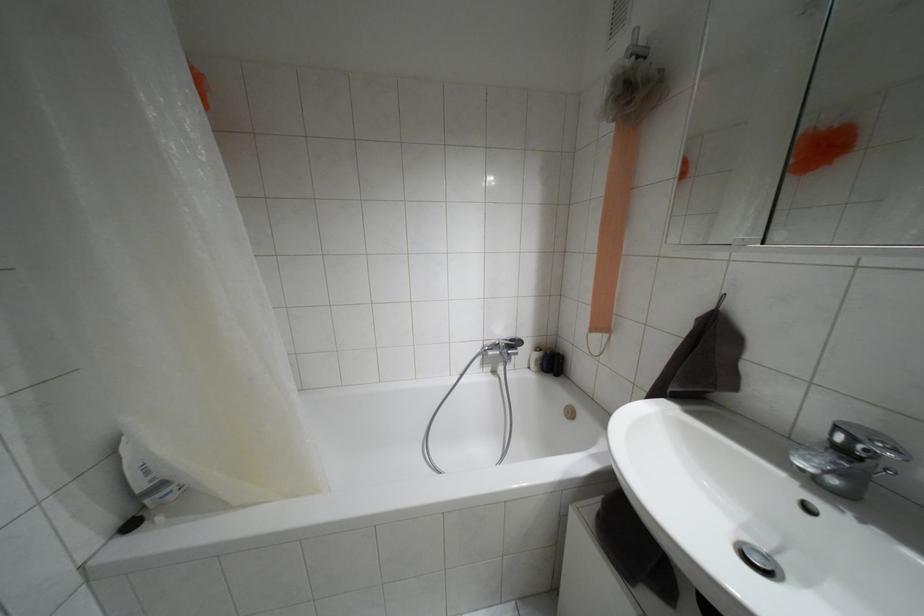
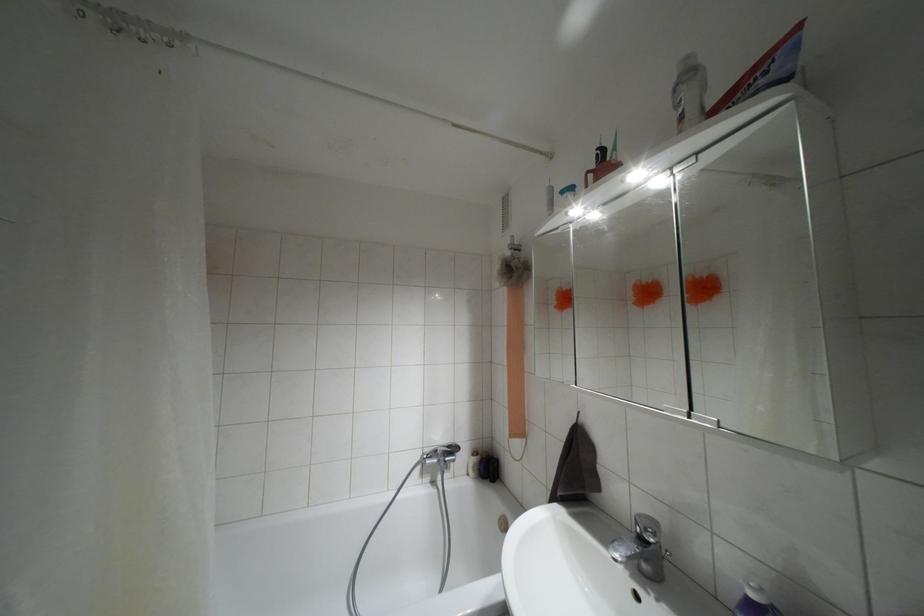
Locate, in the second image, the point that corresponds to the point at 843,450 in the first image.

(641, 538)